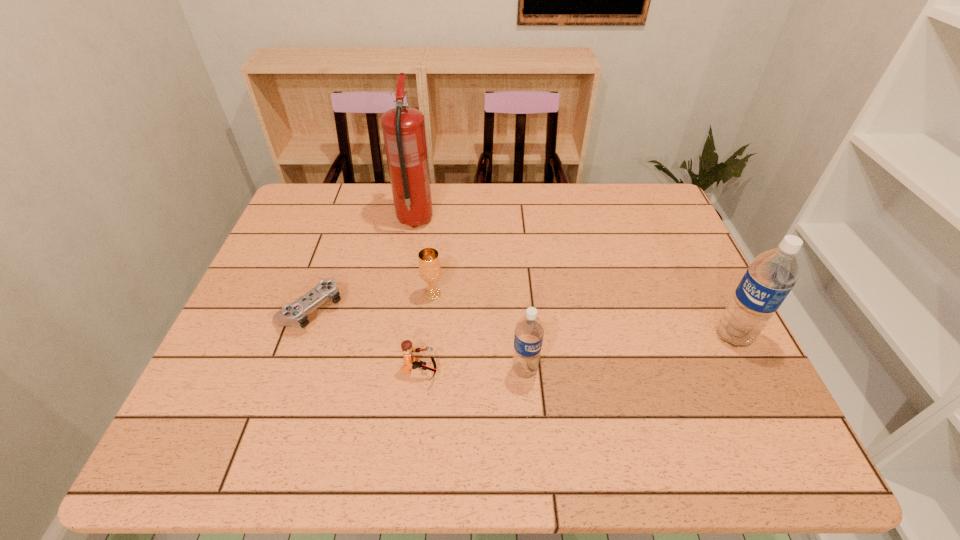
Find the location of `vacant position located 0.320m on the back of the left water bottle`. vacant position located 0.320m on the back of the left water bottle is located at coordinates point(516,263).

Find the location of `vacant space located 0.250m on the left of the taller water bottle`. vacant space located 0.250m on the left of the taller water bottle is located at coordinates (610, 336).

Locate an element on the screen. The image size is (960, 540). free space located on the handle side the fire extinguisher is located at coordinates (420, 191).

The width and height of the screenshot is (960, 540). I want to click on vacant space located 0.090m on the right of the chalice, so [x=478, y=294].

Find the location of `vacant area situated 0.140m holding a crossbow in the hands of the fifth tallest object`. vacant area situated 0.140m holding a crossbow in the hands of the fifth tallest object is located at coordinates (501, 371).

Locate an element on the screen. vacant area situated 0.110m on the back of the control is located at coordinates (329, 257).

Image resolution: width=960 pixels, height=540 pixels. What are the coordinates of `object at the far edge` in the screenshot? It's located at (403, 127).

Identify the location of water bottle located in the near edge section of the desktop. (529, 331).

You are a GUI agent. You are given a task and a screenshot of the screen. Output one action in this format:
    pyautogui.click(x=<x>, y=<y>)
    Task: Click on the Lego at the near edge
    
    Given the screenshot: What is the action you would take?
    pyautogui.click(x=410, y=362)

Locate an element on the screen. Image resolution: width=960 pixels, height=540 pixels. object that is at the left edge is located at coordinates (294, 314).